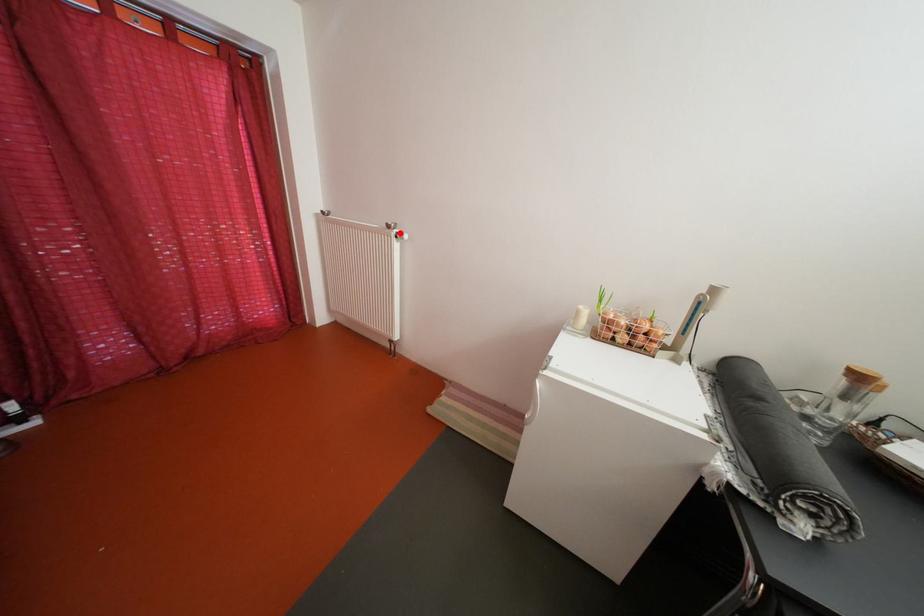
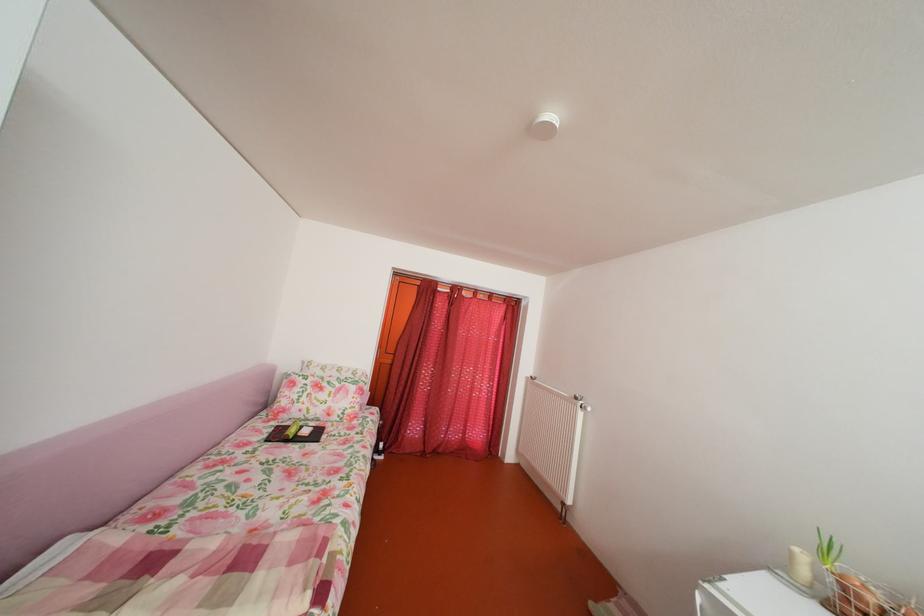
In the second image, find the point that corresponds to the highlighted location in the first image.

(588, 405)